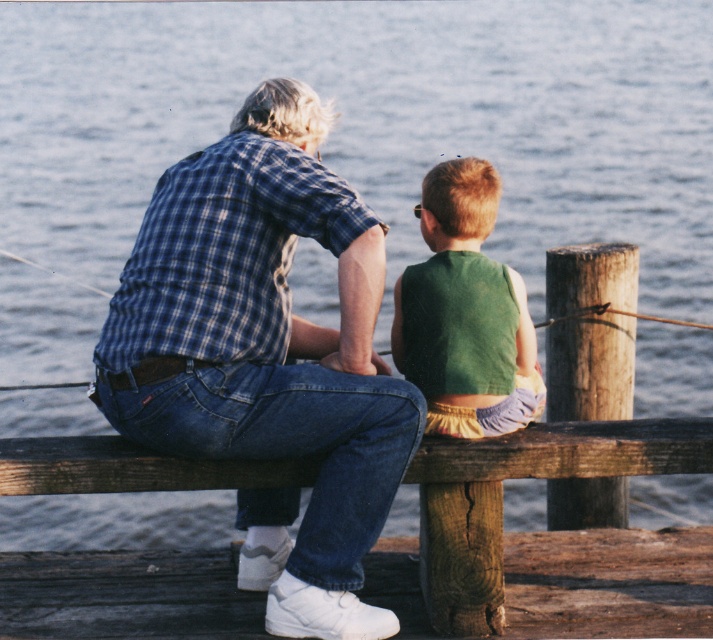
Does wooden bench at center appear over green fabric vest at center?

Actually, wooden bench at center is below green fabric vest at center.

Who is more forward, (205, 474) or (448, 339)?

Point (205, 474)

Who is more distant from viewer, [627,440] or [426,388]?

Point [426,388]

Locate an element on the screen. wooden bench at center is located at coordinates (570, 451).

Between blue plaid shirt at upper left and wooden bench at center, which one is positioned lower?

wooden bench at center is below.

Which is behind, point (168, 372) or point (622, 435)?

The point (622, 435) is behind.

You are a GUI agent. You are given a task and a screenshot of the screen. Output one action in this format:
    pyautogui.click(x=<x>, y=<y>)
    Task: Click on the blue plaid shirt at upper left
    
    Given the screenshot: What is the action you would take?
    pyautogui.click(x=266, y=355)

Does point (230, 310) come in front of point (429, 205)?

Yes, point (230, 310) is closer to viewer.

Between point (343, 579) and point (525, 378), which one is positioned in front?

Point (343, 579) is in front.

Between point (148, 374) and point (463, 163), which one is positioned in front?

Point (148, 374) is in front.

Where is `blue plaid shirt at upper left`? The width and height of the screenshot is (713, 640). blue plaid shirt at upper left is located at coordinates (266, 355).